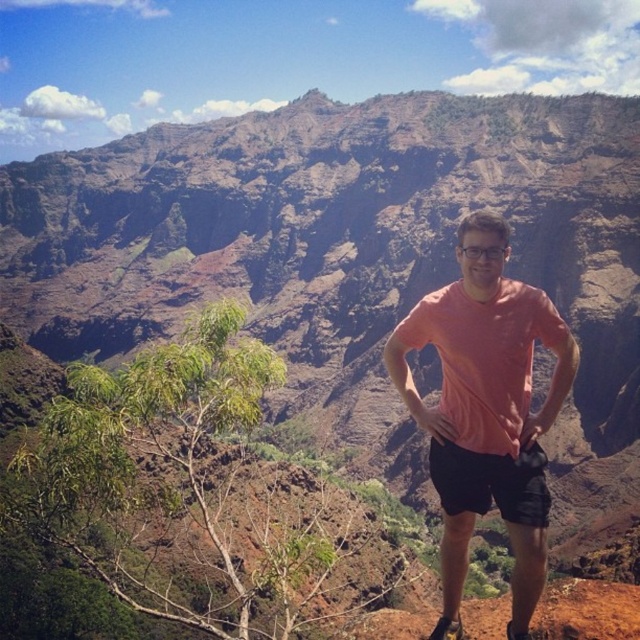
Question: Does pink cotton shirt at center appear on the left side of black cotton shorts at center?

Choices:
 (A) yes
 (B) no

Answer: (B)

Question: Where is pink cotton shirt at center located in relation to black cotton shorts at center in the image?

Choices:
 (A) above
 (B) below

Answer: (A)

Question: Which of the following is the farthest from the observer?

Choices:
 (A) (474, 461)
 (B) (513, 621)

Answer: (A)

Question: Does pink cotton shirt at center appear over black cotton shorts at center?

Choices:
 (A) no
 (B) yes

Answer: (B)